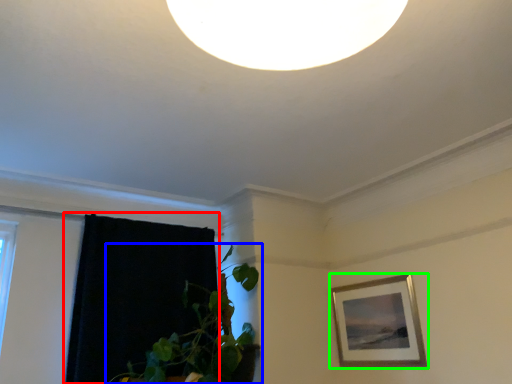
Question: Which object is positioned farthest from curtain (highlighted by a red box)? Select from houseplant (highlighted by a blue box) and picture frame (highlighted by a green box).

Choices:
 (A) houseplant
 (B) picture frame

Answer: (B)